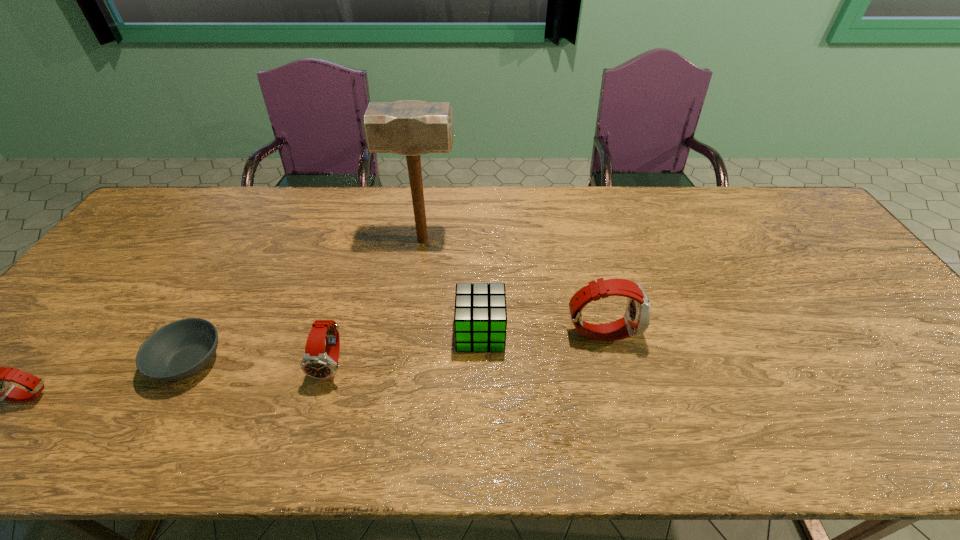
I want to click on vacant area between the cube and the tallest watch, so click(x=540, y=332).

Where is `vacant area that lies between the cube and the tallest object`? vacant area that lies between the cube and the tallest object is located at coordinates (451, 286).

This screenshot has height=540, width=960. Identify the location of vacant space that's between the third object from right to left and the fourth object from right to left. (377, 301).

Locate an element on the screen. The height and width of the screenshot is (540, 960). free point between the tallest object and the shortest object is located at coordinates (306, 301).

Image resolution: width=960 pixels, height=540 pixels. Find the location of `free space that is in between the fifth shortest object and the mallet`. free space that is in between the fifth shortest object and the mallet is located at coordinates (512, 286).

Identify which object is the fifth nearest to the mallet. Please provide its 2D coordinates. Your answer should be formatted as a tuple, i.e. [(x, y)], where the tuple contains the x and y coordinates of a point satisfying the conditions above.

[(0, 386)]

Select which object is the fourth closest to the tallest object. Please provide its 2D coordinates. Your answer should be formatted as a tuple, i.e. [(x, y)], where the tuple contains the x and y coordinates of a point satisfying the conditions above.

[(181, 349)]

Identify which watch is the closest to the fifth object from right to left. Please provide its 2D coordinates. Your answer should be formatted as a tuple, i.e. [(x, y)], where the tuple contains the x and y coordinates of a point satisfying the conditions above.

[(0, 386)]

Image resolution: width=960 pixels, height=540 pixels. Identify the location of the closest watch to the fifth object from right to left. (0, 386).

You are a GUI agent. You are given a task and a screenshot of the screen. Output one action in this format:
    pyautogui.click(x=<x>, y=<y>)
    Task: Click on the vacant position in the image that satisfies the following two spatial constraints: 1. on the striking face of the cube; 2. on the right side of the tallest object
    The height and width of the screenshot is (540, 960).
    Given the screenshot: What is the action you would take?
    point(410,333)